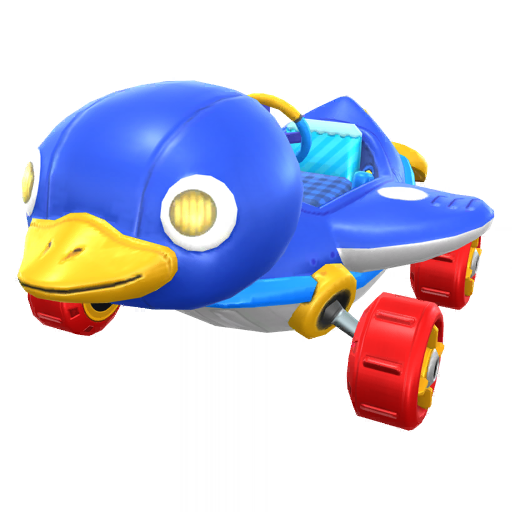
Image resolution: width=512 pixels, height=512 pixels. What are the coordinates of `seat` in the screenshot? It's located at (327, 185).